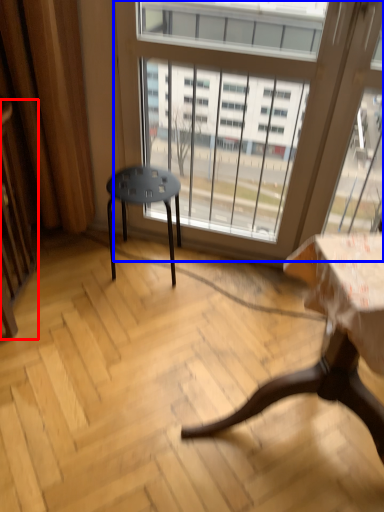
Question: Which object is closer to the camera taking this photo, screen door (highlighted by a red box) or window (highlighted by a blue box)?

Choices:
 (A) screen door
 (B) window

Answer: (A)